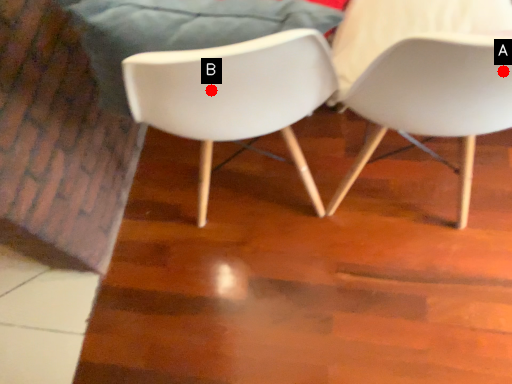
Question: Two points are circled on the image, labeled by A and B beside each circle. Which point is further to the camera?

Choices:
 (A) A is further
 (B) B is further

Answer: (B)